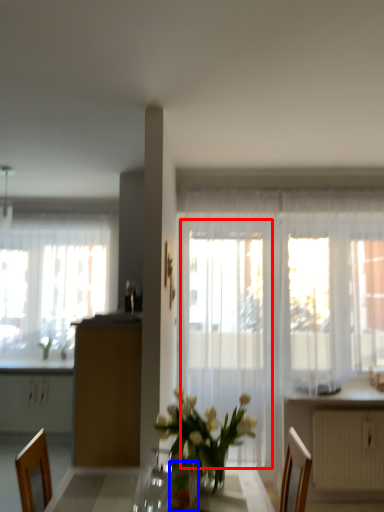
Question: Which object is further to the camera taking this photo, screen door (highlighted by a red box) or vase (highlighted by a blue box)?

Choices:
 (A) screen door
 (B) vase

Answer: (A)